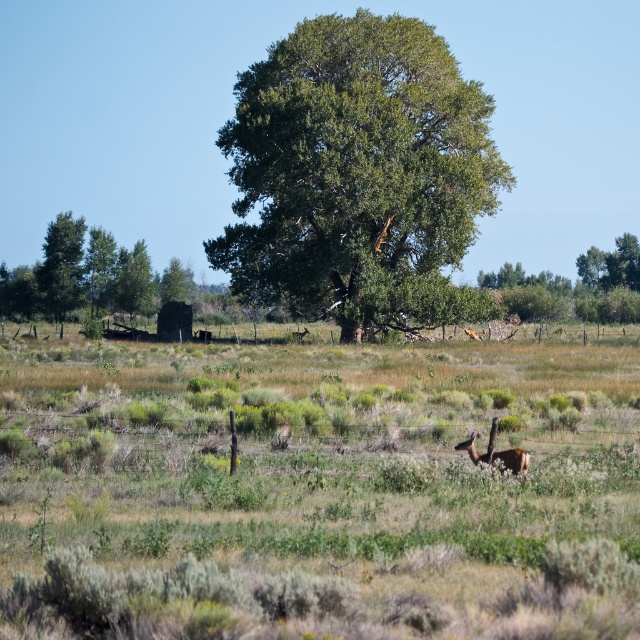
Does green leafy tree at left appear on the left side of green leafy tree at upper left?

In fact, green leafy tree at left is to the right of green leafy tree at upper left.

Is green leafy tree at left thinner than green leafy tree at upper left?

No.

Describe the element at coordinates (84, 275) in the screenshot. I see `green leafy tree at left` at that location.

You are a GUI agent. You are given a task and a screenshot of the screen. Output one action in this format:
    pyautogui.click(x=<x>, y=<y>)
    Task: Click on the green leafy tree at left
    Image resolution: width=640 pixels, height=640 pixels.
    Given the screenshot: What is the action you would take?
    pyautogui.click(x=84, y=275)

Which of these two, green leafy oak tree at center or green leafy tree at left, stands shorter?

With less height is green leafy tree at left.

Is point (253, 284) less distant than point (93, 240)?

Yes, it is in front of point (93, 240).

Does point (259, 272) come behind point (148, 268)?

No, (259, 272) is closer to viewer.

At what (x,y) coordinates should I click in order to perform the action: click on green leafy oak tree at center. Please return your answer as a coordinate pair (x, y). Image resolution: width=640 pixels, height=640 pixels. Looking at the image, I should click on pos(353,166).

Does brown furry antelope at center have a smaller size compared to green leafy tree at upper left?

Yes.

Is brown furry antelope at center thinner than green leafy tree at upper left?

Indeed, brown furry antelope at center has a lesser width compared to green leafy tree at upper left.

The image size is (640, 640). What are the coordinates of `brown furry antelope at center` in the screenshot? It's located at (496, 451).